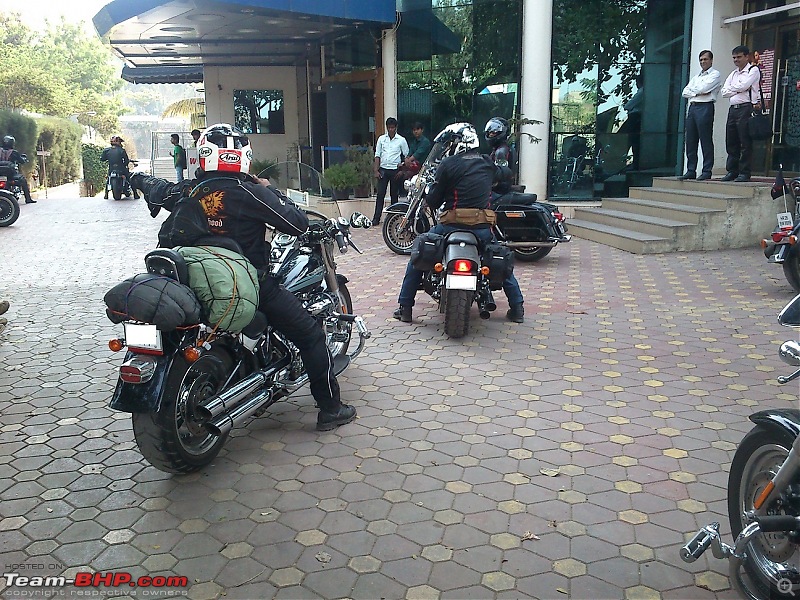
At what (x,y) coordinates should I click in order to perform the action: click on handle. Please return your answer as a coordinate pair (x, y). This screenshot has height=600, width=800. Looking at the image, I should click on (342, 236).